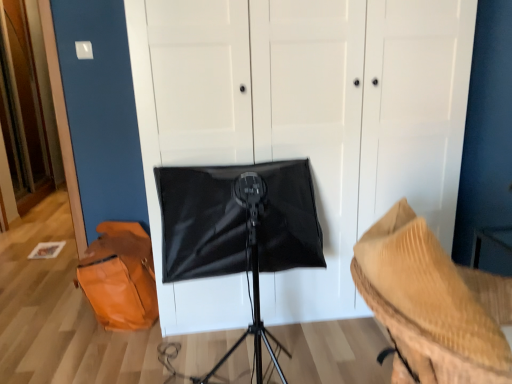
Question: Is point (276, 74) positioned closer to the camera than point (134, 329)?

Choices:
 (A) farther
 (B) closer

Answer: (B)

Question: Is black matte softbox at center to the left or to the right of orange leather messenger bag at lower left in the image?

Choices:
 (A) right
 (B) left

Answer: (A)

Question: Which object is positioned farthest from the rippled beige fabric at lower right?

Choices:
 (A) orange leather messenger bag at lower left
 (B) black matte softbox at center

Answer: (A)

Question: Estimate the real-world distances between objects in this image. Which object is farther from the black matte softbox at center?

Choices:
 (A) orange leather messenger bag at lower left
 (B) rippled beige fabric at lower right

Answer: (B)